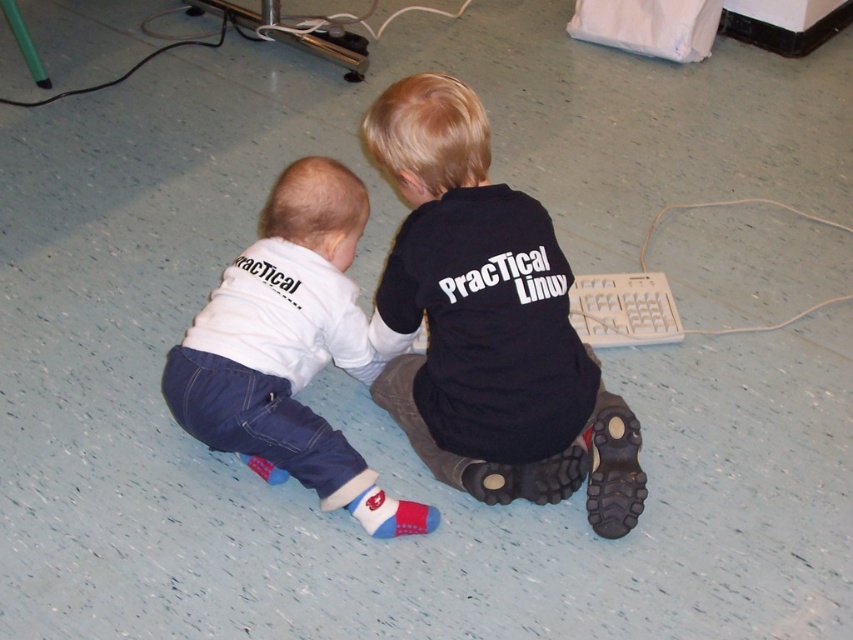
You are standing in front of the two children and want to place a small sticker on the floor. You have two options for placement based on coordinates given. Which coordinate point, point (424, 429) or point (200, 314), is closer to you?

Point (424, 429) is closer to you than point (200, 314).

You are standing in front of the two children on the light blue speckled floor. You need to place a new keyboard exactly where the black matte shirt at center is located. Can you confirm the exact coordinates where you should place the keyboard?

The exact coordinates for the black matte shirt at center are at point [488,323], so you should place the keyboard there.